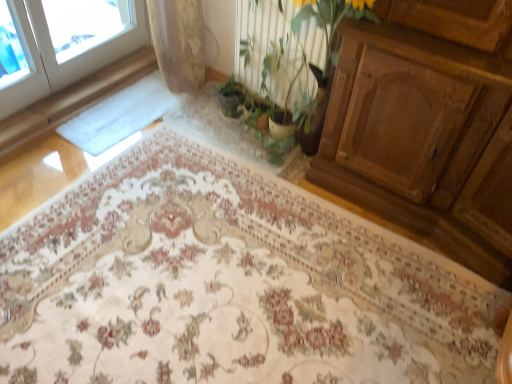
Question: From the image's perspective, is green leafy plant at center positioned above or below green matte plant at center?

Choices:
 (A) below
 (B) above

Answer: (B)

Question: Is green leafy plant at center taller or shorter than green matte plant at center?

Choices:
 (A) short
 (B) tall

Answer: (B)

Question: Considering the real-world distances, which object is closest to the green matte plant at center?

Choices:
 (A) green leafy plant at center
 (B) floral carpet at center

Answer: (A)

Question: Considering the real-world distances, which object is farthest from the floral carpet at center?

Choices:
 (A) green matte plant at center
 (B) green leafy plant at center

Answer: (A)